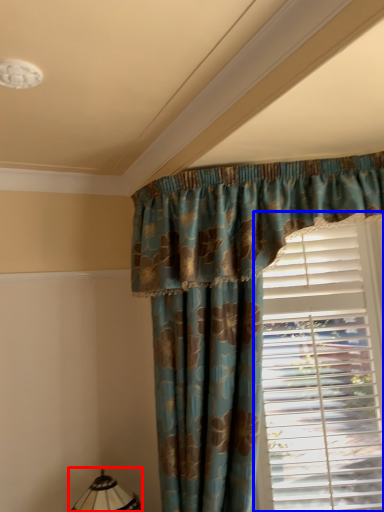
Question: Which object appears farthest to the camera in this image, table lamp (highlighted by a red box) or window blind (highlighted by a blue box)?

Choices:
 (A) table lamp
 (B) window blind

Answer: (B)